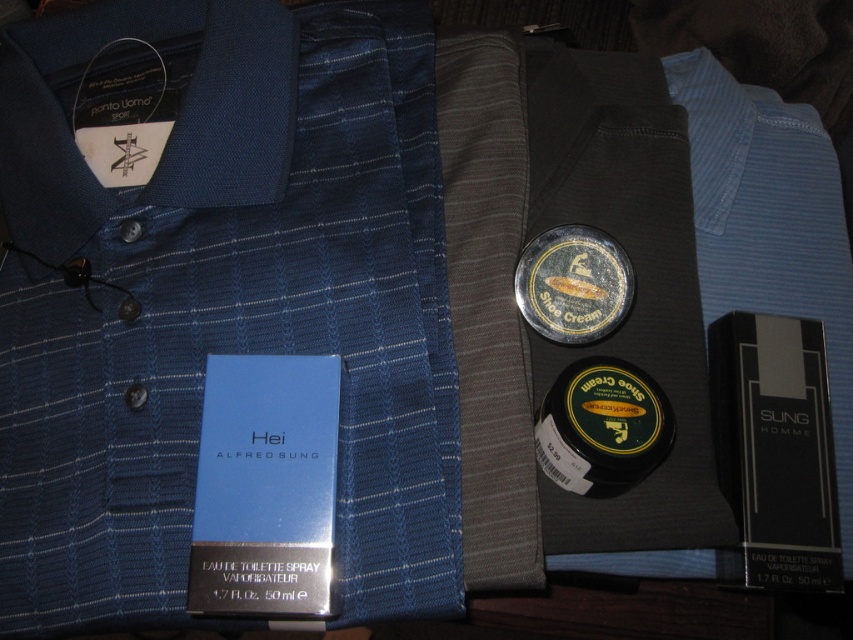
Consider the image. Is blue woven dress shirt at center in front of blue cardboard box at center?

No, blue woven dress shirt at center is further to the viewer.

You are a GUI agent. You are given a task and a screenshot of the screen. Output one action in this format:
    pyautogui.click(x=<x>, y=<y>)
    Task: Click on the blue woven dress shirt at center
    This screenshot has width=853, height=640.
    Given the screenshot: What is the action you would take?
    pyautogui.click(x=219, y=296)

Is blue cardboard box at center above green matte shoe cream at center?

Incorrect, blue cardboard box at center is not positioned above green matte shoe cream at center.

Is blue cardboard box at center positioned behind green matte shoe cream at center?

No, blue cardboard box at center is in front of green matte shoe cream at center.

Is point (299, 426) closer to viewer compared to point (524, 298)?

Yes, point (299, 426) is in front of point (524, 298).

The height and width of the screenshot is (640, 853). Identify the location of blue cardboard box at center. (265, 486).

Is blue woven dress shirt at center above green matte shoe cream at center?

Incorrect, blue woven dress shirt at center is not positioned above green matte shoe cream at center.

Consider the image. Is blue woven dress shirt at center smaller than green matte shoe cream at center?

No.

Is point (352, 465) farther from viewer compared to point (569, 316)?

No, it is in front of (569, 316).

Identify the location of blue woven dress shirt at center. The width and height of the screenshot is (853, 640). (219, 296).